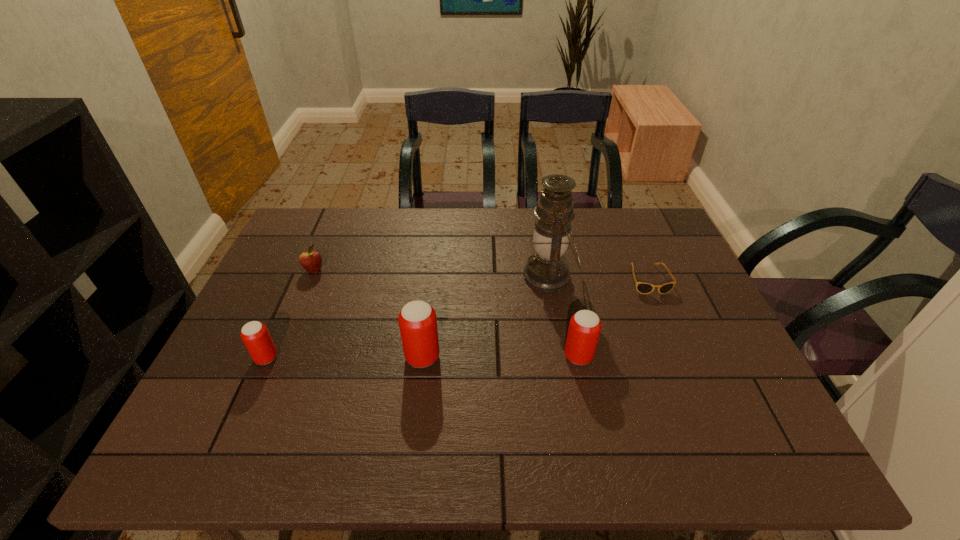
This screenshot has height=540, width=960. I want to click on free point between the tallest object and the second shortest beer can, so click(564, 316).

Where is `free space between the rightmost object and the oil lamp`? free space between the rightmost object and the oil lamp is located at coordinates (598, 278).

What are the coordinates of `free area in between the shortest beer can and the second shortest object` in the screenshot? It's located at (290, 314).

This screenshot has height=540, width=960. What are the coordinates of `vacant area that lies between the sunglasses and the fifth tallest object` in the screenshot? It's located at (481, 275).

The width and height of the screenshot is (960, 540). What are the coordinates of `object that stands as the second closest to the second beer can from left to right` in the screenshot? It's located at (584, 329).

Identify the location of the third closest object relative to the leftmost beer can. This screenshot has height=540, width=960. (547, 270).

Where is `beer can that is the nearest to the leftmost beer can`? The image size is (960, 540). beer can that is the nearest to the leftmost beer can is located at coordinates (417, 320).

The image size is (960, 540). Find the location of `beer can that is the second closest one to the sunglasses`. beer can that is the second closest one to the sunglasses is located at coordinates (417, 320).

Where is `vacant area that satisfies the following two spatial constraints: 1. on the front side of the fourth shortest object; 2. on the left side of the tallest object`? The height and width of the screenshot is (540, 960). vacant area that satisfies the following two spatial constraints: 1. on the front side of the fourth shortest object; 2. on the left side of the tallest object is located at coordinates (563, 356).